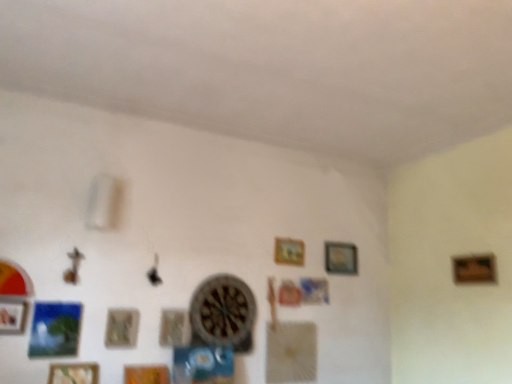
Question: Can wooden picture frame at upper center, which is counted as the seventh picture frame, starting from the left, be found inside wooden frame at right, the 8th picture frame when ordered from left to right?

Choices:
 (A) no
 (B) yes

Answer: (A)

Question: Can you confirm if wooden frame at right, the 8th picture frame when ordered from left to right, is shorter than wooden picture frame at upper center, positioned as the 2th picture frame in right-to-left order?

Choices:
 (A) no
 (B) yes

Answer: (B)

Question: Considering the relative positions of wooden frame at right, the 8th picture frame when ordered from left to right, and wooden picture frame at upper center, positioned as the 2th picture frame in right-to-left order, in the image provided, is wooden frame at right, the 8th picture frame when ordered from left to right, to the right of wooden picture frame at upper center, positioned as the 2th picture frame in right-to-left order, from the viewer's perspective?

Choices:
 (A) no
 (B) yes

Answer: (B)

Question: Is wooden frame at right, the 8th picture frame when ordered from left to right, positioned far away from wooden picture frame at upper center, positioned as the 2th picture frame in right-to-left order?

Choices:
 (A) no
 (B) yes

Answer: (A)

Question: Considering the relative positions of wooden frame at right, the 1th picture frame in the right-to-left sequence, and wooden picture frame at upper center, which is counted as the seventh picture frame, starting from the left, in the image provided, is wooden frame at right, the 1th picture frame in the right-to-left sequence, to the left of wooden picture frame at upper center, which is counted as the seventh picture frame, starting from the left, from the viewer's perspective?

Choices:
 (A) yes
 (B) no

Answer: (B)

Question: From a real-world perspective, is wooden frame at right, the 8th picture frame when ordered from left to right, over wooden picture frame at upper center, positioned as the 2th picture frame in right-to-left order?

Choices:
 (A) no
 (B) yes

Answer: (A)

Question: Considering the relative sizes of wooden picture frame at lower left, placed as the seventh picture frame when sorted from right to left, and wooden textured picture frame at lower left, which is the 3th picture frame in left-to-right order, in the image provided, is wooden picture frame at lower left, placed as the seventh picture frame when sorted from right to left, wider than wooden textured picture frame at lower left, which is the 3th picture frame in left-to-right order,?

Choices:
 (A) yes
 (B) no

Answer: (B)

Question: From a real-world perspective, is wooden picture frame at lower left, placed as the seventh picture frame when sorted from right to left, over wooden textured picture frame at lower left, the sixth picture frame from the right?

Choices:
 (A) no
 (B) yes

Answer: (A)

Question: Does wooden picture frame at lower left, placed as the seventh picture frame when sorted from right to left, lie in front of wooden textured picture frame at lower left, which is the 3th picture frame in left-to-right order?

Choices:
 (A) yes
 (B) no

Answer: (A)

Question: Is wooden textured picture frame at lower left, the sixth picture frame from the right, surrounded by wooden picture frame at lower left, the 2th picture frame positioned from the left?

Choices:
 (A) yes
 (B) no

Answer: (B)

Question: Could you tell me if wooden picture frame at lower left, placed as the seventh picture frame when sorted from right to left, is turned towards wooden textured picture frame at lower left, which is the 3th picture frame in left-to-right order?

Choices:
 (A) yes
 (B) no

Answer: (B)

Question: Would you say wooden picture frame at lower left, placed as the seventh picture frame when sorted from right to left, is a long distance from wooden textured picture frame at lower left, which is the 3th picture frame in left-to-right order?

Choices:
 (A) no
 (B) yes

Answer: (A)

Question: Is wooden textured picture frame at lower left, which is the 3th picture frame in left-to-right order, not close to wooden picture frame at lower left, the eighth picture frame from the right?

Choices:
 (A) no
 (B) yes

Answer: (A)